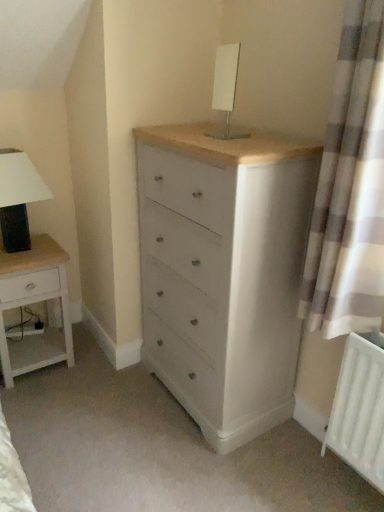
Measure the distance between point (214, 76) and camera.

6.60 feet.

This screenshot has width=384, height=512. I want to click on white wood nightstand at left, so click(34, 303).

Looking at this image, what is the approximate width of white wood nightstand at left?

white wood nightstand at left is 38.14 centimeters in width.

The width and height of the screenshot is (384, 512). I want to click on matte black lampshade at left, the second table lamp positioned from the front, so click(x=18, y=197).

Identify the location of matte white chest of drawers at center. (224, 273).

Looking at this image, are white checkered curtain at right and white wood nightstand at left far apart?

Yes.

Which is in front, white checkered curtain at right or white wood nightstand at left?

white checkered curtain at right.

From a real-world perspective, is white checkered curtain at right under white wood nightstand at left?

No, from a real-world perspective, white checkered curtain at right is not beneath white wood nightstand at left.

Does white checkered curtain at right appear on the right side of white wood nightstand at left?

Yes, white checkered curtain at right is to the right of white wood nightstand at left.

From the image's perspective, which is below, white glossy table lamp at upper center, which is the 1th table lamp from top to bottom, or matte black lampshade at left, the second table lamp positioned from the front?

From the image's view, matte black lampshade at left, the second table lamp positioned from the front, is below.

Is point (232, 74) closer or farther from the camera than point (18, 210)?

Point (232, 74) is closer to the camera than point (18, 210).

Between white glossy table lamp at upper center, the first table lamp in the front-to-back sequence, and matte black lampshade at left, which is the 1th table lamp from bottom to top, which one has larger width?

matte black lampshade at left, which is the 1th table lamp from bottom to top.

Can you tell me how much white glossy table lamp at upper center, the 2th table lamp in the bottom-to-top sequence, and matte black lampshade at left, the second table lamp positioned from the front, differ in facing direction?

There is a 90-degree angle between the facing directions of white glossy table lamp at upper center, the 2th table lamp in the bottom-to-top sequence, and matte black lampshade at left, the second table lamp positioned from the front.

Is matte black lampshade at left, which ranks as the 2th table lamp in right-to-left order, turned away from matte white chest of drawers at center?

No, matte black lampshade at left, which ranks as the 2th table lamp in right-to-left order,'s orientation is not away from matte white chest of drawers at center.

Image resolution: width=384 pixels, height=512 pixels. I want to click on chest of drawers in front of the matte black lampshade at left, the second table lamp positioned from the front, so click(224, 273).

Based on their sizes in the image, would you say matte black lampshade at left, which appears as the first table lamp when viewed from the left, is bigger or smaller than matte white chest of drawers at center?

Considering their sizes, matte black lampshade at left, which appears as the first table lamp when viewed from the left, takes up less space than matte white chest of drawers at center.

From a real-world perspective, which object stands above the other?

From a 3D spatial view, matte black lampshade at left, which appears as the first table lamp when viewed from the left, is above.

Which is more to the right, white wood nightstand at left or white matte radiator at lower right?

Positioned to the right is white matte radiator at lower right.

Are white wood nightstand at left and white matte radiator at lower right located far from each other?

That's right, there is a large distance between white wood nightstand at left and white matte radiator at lower right.

Does white wood nightstand at left have a lesser height compared to white matte radiator at lower right?

Indeed, white wood nightstand at left has a lesser height compared to white matte radiator at lower right.

Can you tell me how much white wood nightstand at left and white matte radiator at lower right differ in facing direction?

The angle between the facing direction of white wood nightstand at left and the facing direction of white matte radiator at lower right is 90 degrees.

Is white glossy table lamp at upper center, arranged as the 2th table lamp when viewed from the back, at the back of white matte radiator at lower right?

No, white matte radiator at lower right is not facing the opposite direction of white glossy table lamp at upper center, arranged as the 2th table lamp when viewed from the back.

The width and height of the screenshot is (384, 512). There is a white matte radiator at lower right. Find the location of `the 2nd table lamp above it (from the image's perspective)`. the 2nd table lamp above it (from the image's perspective) is located at coordinates (226, 85).

Is white matte radiator at lower right not near white glossy table lamp at upper center, which is the 1th table lamp from top to bottom?

white matte radiator at lower right is far away from white glossy table lamp at upper center, which is the 1th table lamp from top to bottom.

Considering the sizes of objects white wood nightstand at left and white checkered curtain at right in the image provided, who is bigger, white wood nightstand at left or white checkered curtain at right?

white wood nightstand at left is bigger.

Which object is thinner, white wood nightstand at left or white checkered curtain at right?

white checkered curtain at right is thinner.

The width and height of the screenshot is (384, 512). I want to click on nightstand behind the white checkered curtain at right, so click(x=34, y=303).

How far apart are white wood nightstand at left and white checkered curtain at right?

white wood nightstand at left is 1.38 meters from white checkered curtain at right.

Which object is positioned more to the left, white checkered curtain at right or white matte radiator at lower right?

white checkered curtain at right is more to the left.

In terms of size, does white checkered curtain at right appear bigger or smaller than white matte radiator at lower right?

white checkered curtain at right is bigger than white matte radiator at lower right.

Would you say white checkered curtain at right is a long distance from white matte radiator at lower right?

No.

From a real-world perspective, is white checkered curtain at right on white matte radiator at lower right?

Yes.

Where is `curtain above the white wood nightstand at left (from a real-world perspective)`? This screenshot has width=384, height=512. curtain above the white wood nightstand at left (from a real-world perspective) is located at coordinates (350, 187).

The width and height of the screenshot is (384, 512). Identify the location of table lamp below the white glossy table lamp at upper center, which is the 1th table lamp from top to bottom (from a real-world perspective). (18, 197).

Which object lies further to the anchor point white wood nightstand at left, white checkered curtain at right or white matte radiator at lower right?

The object further to white wood nightstand at left is white matte radiator at lower right.

Which object lies further to the anchor point white wood nightstand at left, matte black lampshade at left, which appears as the first table lamp when viewed from the left, or white matte radiator at lower right?

The object further to white wood nightstand at left is white matte radiator at lower right.

Considering their positions, is white glossy table lamp at upper center, the first table lamp in the front-to-back sequence, positioned further to matte black lampshade at left, which ranks as the 2th table lamp in right-to-left order, than white wood nightstand at left?

Based on the image, white glossy table lamp at upper center, the first table lamp in the front-to-back sequence, appears to be further to matte black lampshade at left, which ranks as the 2th table lamp in right-to-left order.

Considering their positions, is white matte radiator at lower right positioned further to matte white chest of drawers at center than white wood nightstand at left?

white wood nightstand at left lies further to matte white chest of drawers at center than the other object.

From the image, which object appears to be farther from matte white chest of drawers at center, white wood nightstand at left or matte black lampshade at left, marked as the 1th table lamp in a back-to-front arrangement?

Based on the image, matte black lampshade at left, marked as the 1th table lamp in a back-to-front arrangement, appears to be further to matte white chest of drawers at center.

Estimate the real-world distances between objects in this image. Which object is closer to white wood nightstand at left, matte white chest of drawers at center or white matte radiator at lower right?

matte white chest of drawers at center lies closer to white wood nightstand at left than the other object.

From the image, which object appears to be farther from matte black lampshade at left, which appears as the first table lamp when viewed from the left, white wood nightstand at left or white glossy table lamp at upper center, which appears as the 2th table lamp when viewed from the left?

The object further to matte black lampshade at left, which appears as the first table lamp when viewed from the left, is white glossy table lamp at upper center, which appears as the 2th table lamp when viewed from the left.

In the scene shown: Considering their positions, is white checkered curtain at right positioned further to white glossy table lamp at upper center, which appears as the 1th table lamp when viewed from the right, than white matte radiator at lower right?

white matte radiator at lower right is positioned further to the anchor white glossy table lamp at upper center, which appears as the 1th table lamp when viewed from the right.

Image resolution: width=384 pixels, height=512 pixels. In order to click on chest of drawers between white wood nightstand at left and white glossy table lamp at upper center, which appears as the 1th table lamp when viewed from the right, from left to right in this screenshot , I will do [224, 273].

Find the location of a particular element. This screenshot has width=384, height=512. chest of drawers between white wood nightstand at left and white checkered curtain at right from left to right is located at coordinates coord(224,273).

The height and width of the screenshot is (512, 384). Identify the location of chest of drawers between white glossy table lamp at upper center, which appears as the 2th table lamp when viewed from the left, and white matte radiator at lower right in the up-down direction. (224, 273).

This screenshot has width=384, height=512. I want to click on table lamp between white wood nightstand at left and matte white chest of drawers at center from left to right, so click(18, 197).